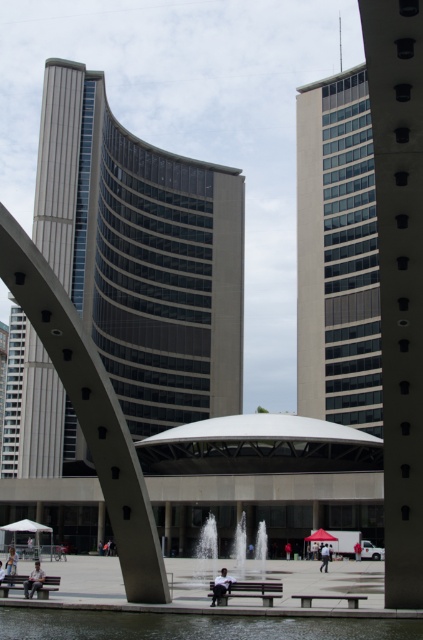
Question: Does glassy steel tower at center have a larger size compared to light brown leather jacket at lower left?

Choices:
 (A) no
 (B) yes

Answer: (B)

Question: Considering the relative positions of light brown leather jacket at lower left and dark blue jeans at center in the image provided, where is light brown leather jacket at lower left located with respect to dark blue jeans at center?

Choices:
 (A) left
 (B) right

Answer: (A)

Question: Which point appears closest to the camera in this image?

Choices:
 (A) (323, 564)
 (B) (381, 84)
 (C) (332, 124)

Answer: (B)

Question: Which point is farther from the camera taking this photo?

Choices:
 (A) (238, 541)
 (B) (315, 88)

Answer: (B)

Question: Can you confirm if glassy steel tower at center is positioned below matte glass tower at upper right?

Choices:
 (A) no
 (B) yes

Answer: (B)

Question: Which point is closer to the camera?

Choices:
 (A) white fabric umbrella at center
 (B) matte glass tower at upper right
 (C) dark blue jeans at center
 (D) clear glass water at center

Answer: (C)